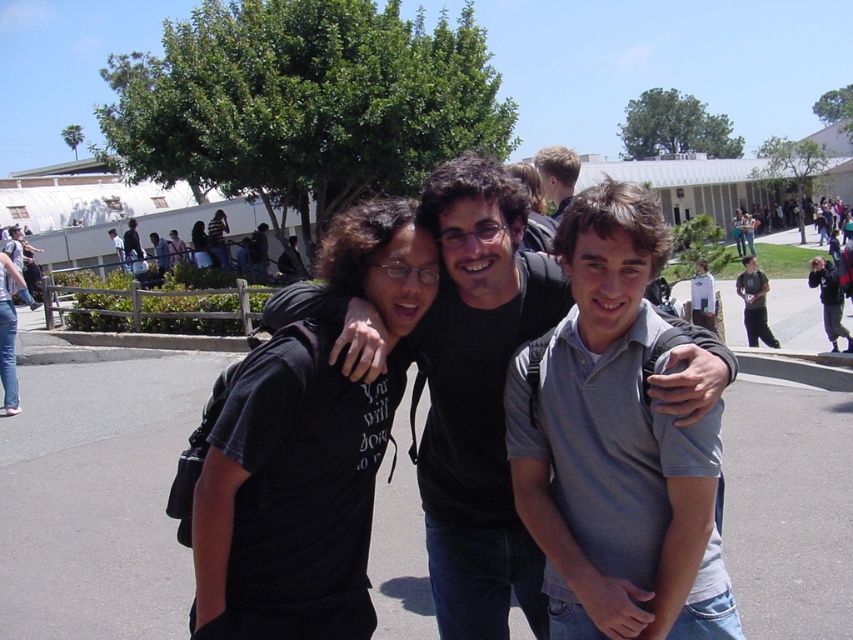
Looking at the three people in the scene, which direction is the black matte shirt at center relative to the light brown hair at upper center?

The black matte shirt at center is to the left of the light brown hair at upper center.

You are standing at the point marked as point [451,449]. You want to throw a frisbee to your friend who is standing 2.34 meters away from you. Is the distance sufficient to make a successful throw?

The distance between you and your friend is 2.34 meters, which is a reasonable distance for a frisbee throw. Yes, the distance is sufficient to make a successful throw.

You are a photographer trying to capture a group photo of the three friends. The black matte shirt at center is exactly at the point marked by coordinates (x=479, y=396). If you want to ensure that all three friends are centered in the photo, should you adjust the camera to focus more towards the left or right of the current position?

The black matte shirt at center is exactly at the point marked by coordinates (x=479, y=396), so to ensure all three friends are centered, you should adjust the camera to focus slightly to the left of the current position since the center point is already occupied by the black matte shirt at center.